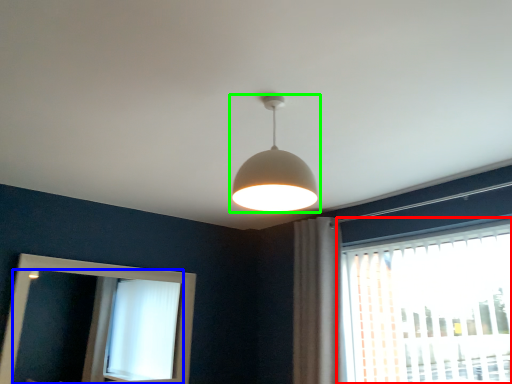
Question: Which object is the closest to the window (highlighted by a red box)? Choose among these: mirror (highlighted by a blue box) or lamp (highlighted by a green box).

Choices:
 (A) mirror
 (B) lamp

Answer: (B)